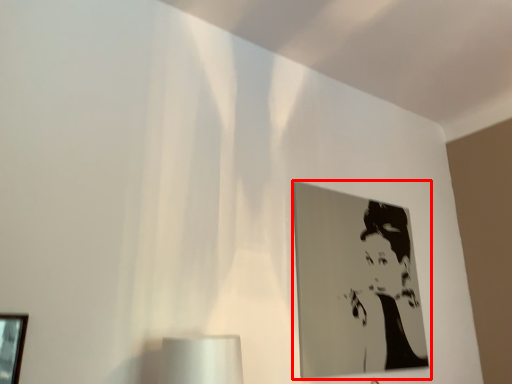
Question: From the image, what is the correct spatial relationship of picture frame (annotated by the red box) in relation to picture frame?

Choices:
 (A) left
 (B) right

Answer: (B)